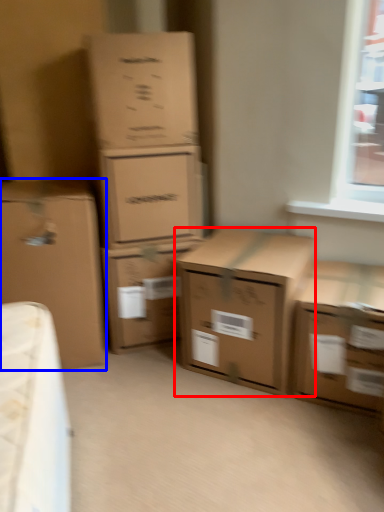
Question: Which of the following is the closest to the observer, box (highlighted by a red box) or box (highlighted by a blue box)?

Choices:
 (A) box
 (B) box

Answer: (A)